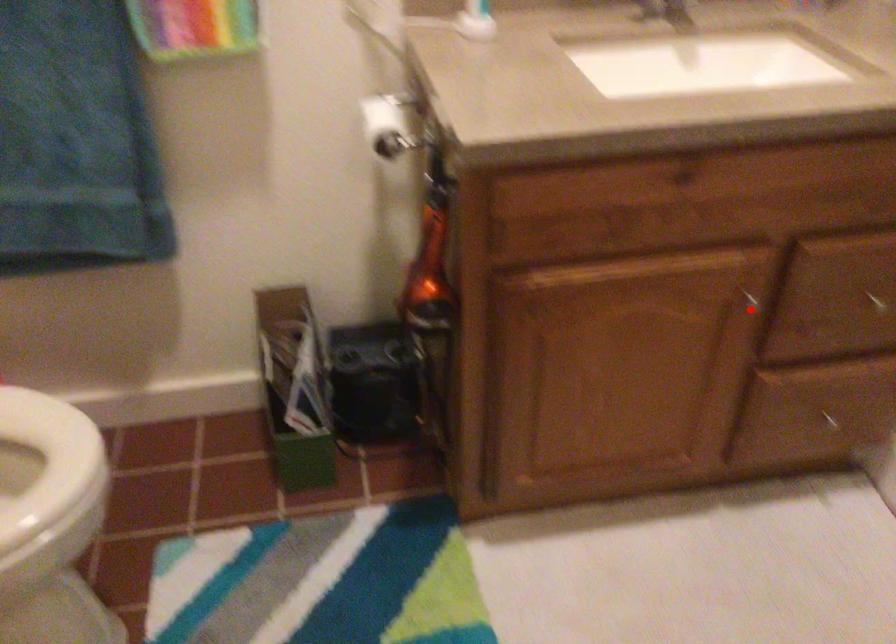
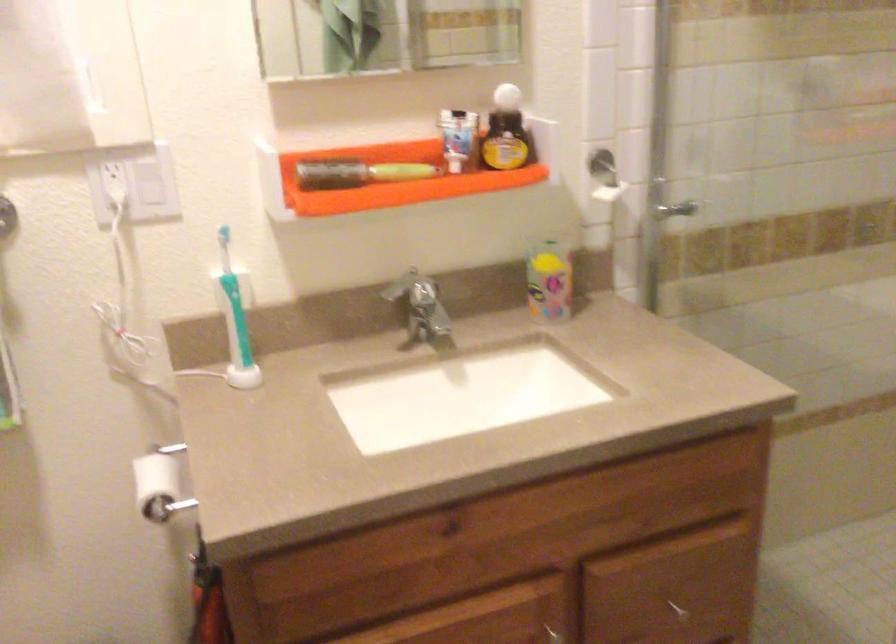
Where in the second image is the point corresponding to the highlighted location from the first image?

(555, 635)